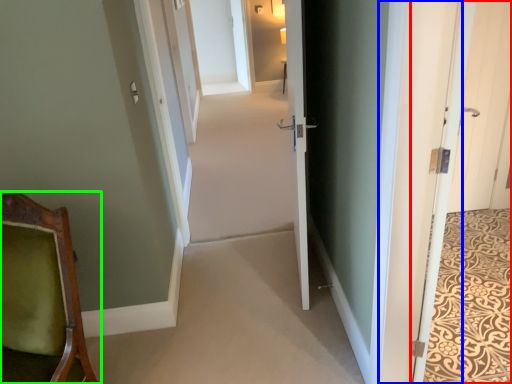
Question: Which object is the farthest from door (highlighted by a red box)? Choose among these: door (highlighted by a blue box) or chair (highlighted by a green box).

Choices:
 (A) door
 (B) chair

Answer: (B)